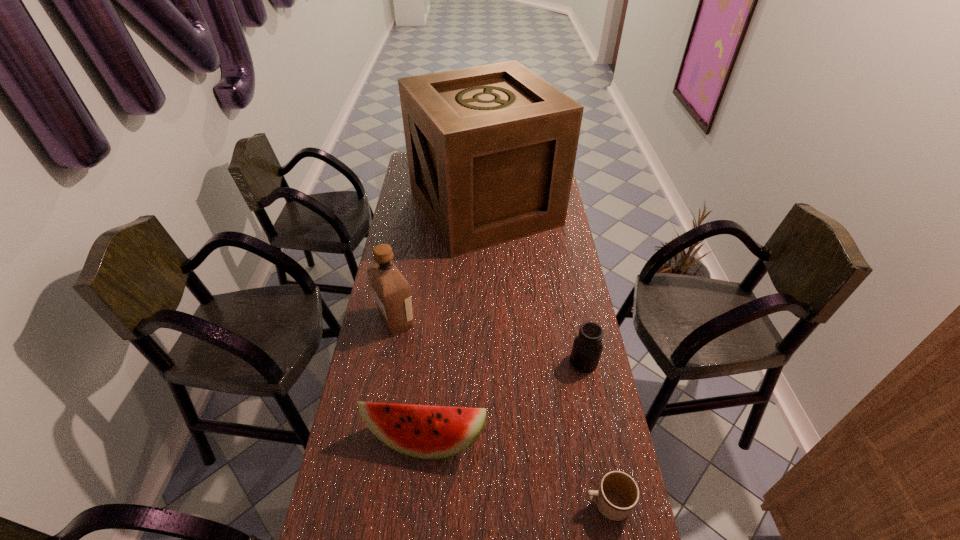
You are a GUI agent. You are given a task and a screenshot of the screen. Output one action in this format:
    pyautogui.click(x=<x>, y=<y>)
    Task: Click on the tallest object
    
    Given the screenshot: What is the action you would take?
    [491, 149]

Find the location of `the farthest object`. the farthest object is located at coordinates (491, 149).

Find the location of a particular element. The height and width of the screenshot is (540, 960). liquor is located at coordinates (391, 290).

At what (x,y) coordinates should I click in order to perform the action: click on the fourth shortest object. Please return your answer as a coordinate pair (x, y). Looking at the image, I should click on (391, 290).

Image resolution: width=960 pixels, height=540 pixels. In order to click on the third tallest object in this screenshot , I will do `click(423, 431)`.

Image resolution: width=960 pixels, height=540 pixels. I want to click on the second nearest object, so click(x=423, y=431).

The height and width of the screenshot is (540, 960). In order to click on the third nearest object in this screenshot , I will do `click(587, 347)`.

Where is `jar`? jar is located at coordinates (587, 347).

In order to click on mug in this screenshot , I will do `click(618, 493)`.

Image resolution: width=960 pixels, height=540 pixels. What are the coordinates of `the nearest object` in the screenshot? It's located at (618, 493).